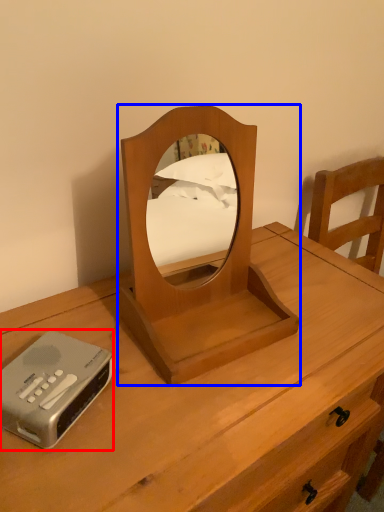
Question: Which object appears closest to the camera in this image, cassette (highlighted by a red box) or mirror (highlighted by a blue box)?

Choices:
 (A) cassette
 (B) mirror

Answer: (B)